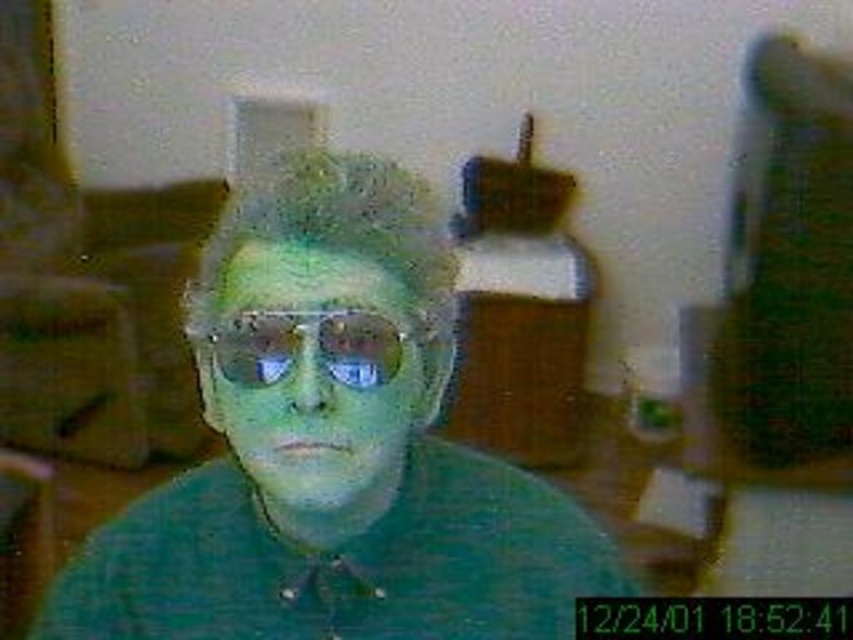
You are a security guard reviewing footage. You notice a person in the center wearing a green matte shirt and metallic reflective sunglasses. Based on the image, can you determine if the green matte shirt at center is above or below the metallic reflective sunglasses at center?

The green matte shirt at center is positioned under the metallic reflective sunglasses at center, so it is below them.